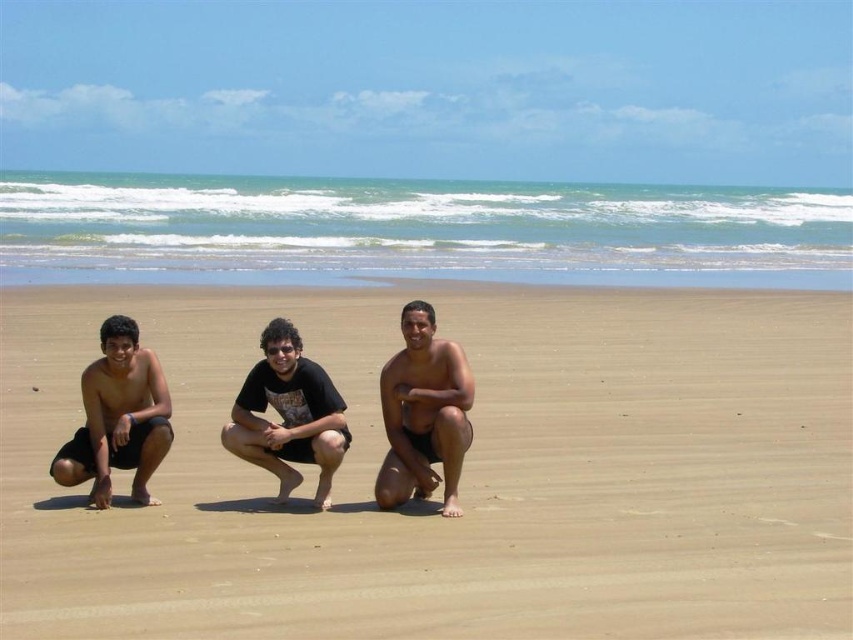
Is matte black shorts at center wider than black matte shorts at left?

No, matte black shorts at center is not wider than black matte shorts at left.

Where is `matte black shorts at center`? The image size is (853, 640). matte black shorts at center is located at coordinates (422, 413).

The image size is (853, 640). Identify the location of matte black shorts at center. (422, 413).

Does brown sandy beach at center have a greater height compared to black matte shorts at center?

Indeed, brown sandy beach at center has a greater height compared to black matte shorts at center.

Between point (795, 620) and point (268, 396), which one is positioned in front?

Point (795, 620) is more forward.

Where is `brown sandy beach at center`? Image resolution: width=853 pixels, height=640 pixels. brown sandy beach at center is located at coordinates (462, 474).

Looking at this image, does black matte shorts at left appear under black matte shorts at center?

No, black matte shorts at left is not below black matte shorts at center.

Does point (105, 484) come in front of point (328, 490)?

Yes, point (105, 484) is closer to viewer.

You are a GUI agent. You are given a task and a screenshot of the screen. Output one action in this format:
    pyautogui.click(x=<x>, y=<y>)
    Task: Click on the black matte shorts at left
    The image size is (853, 640).
    Given the screenshot: What is the action you would take?
    pyautogui.click(x=119, y=417)